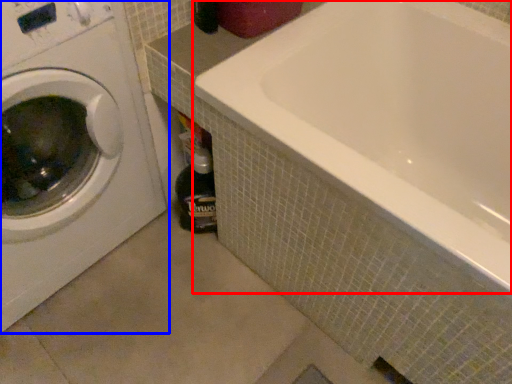
Question: Which object is closer to the camera taking this photo, bathtub (highlighted by a red box) or washing machine (highlighted by a blue box)?

Choices:
 (A) bathtub
 (B) washing machine

Answer: (B)